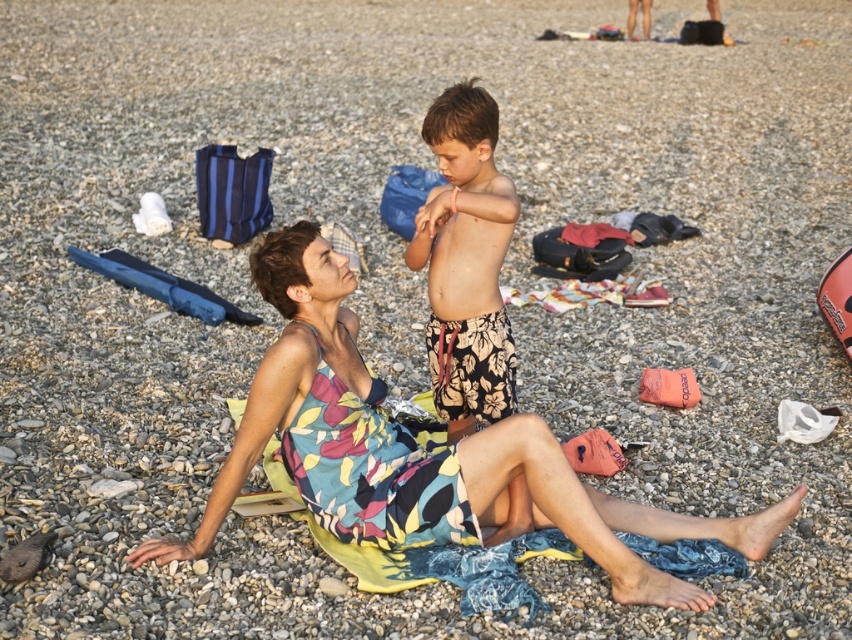
Question: Which point is closer to the camera?

Choices:
 (A) floral swim trunks at center
 (B) floral dress at center

Answer: (B)

Question: Considering the relative positions of floral dress at center and floral swim trunks at center in the image provided, where is floral dress at center located with respect to floral swim trunks at center?

Choices:
 (A) left
 (B) right

Answer: (B)

Question: Does floral dress at center appear on the left side of floral swim trunks at center?

Choices:
 (A) yes
 (B) no

Answer: (B)

Question: Does floral dress at center have a lesser width compared to floral swim trunks at center?

Choices:
 (A) no
 (B) yes

Answer: (A)

Question: Which point appears closest to the camera in this image?

Choices:
 (A) (292, 404)
 (B) (433, 232)

Answer: (A)